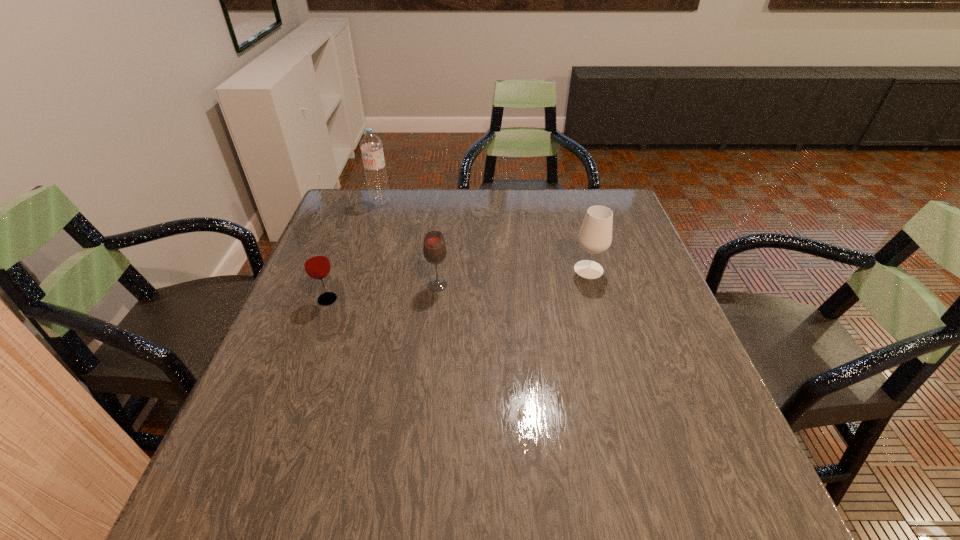
What are the coordinates of `object that can be found as the third closest to the rightmost glass` in the screenshot? It's located at (371, 146).

Locate an element on the screen. This screenshot has width=960, height=540. the second closest glass relative to the second object from right to left is located at coordinates (595, 236).

Image resolution: width=960 pixels, height=540 pixels. Find the location of `glass that is the third closest to the water bottle`. glass that is the third closest to the water bottle is located at coordinates (595, 236).

You are a GUI agent. You are given a task and a screenshot of the screen. Output one action in this format:
    pyautogui.click(x=<x>, y=<y>)
    Task: Click on the free space that satisfies the following two spatial constraints: 1. on the front side of the tallest object; 2. on the right side of the rightmost object
    This screenshot has width=960, height=540.
    Given the screenshot: What is the action you would take?
    pyautogui.click(x=359, y=269)